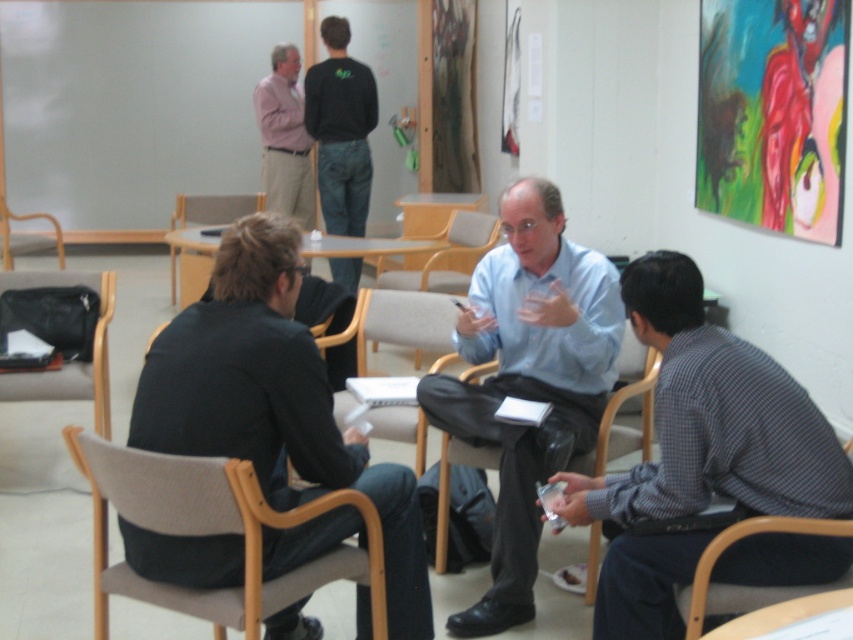
You are an office worker who needs to sit down. You see a wooden chair at center and a light gray fabric chair at center. Which chair is located above the other?

The wooden chair at center is positioned under the light gray fabric chair at center, so the light gray fabric chair at center is above the wooden chair at center.

Based on the scene description, what object is located at the coordinates point [399,324]?

The point [399,324] indicates a light gray wood chair at center.

You are standing at the back of the room and want to approach the wooden chair at center and the light gray fabric chair at center. Which chair will you reach first?

The wooden chair at center is closer to the viewer than the light gray fabric chair at center, so you will reach the wooden chair at center first.